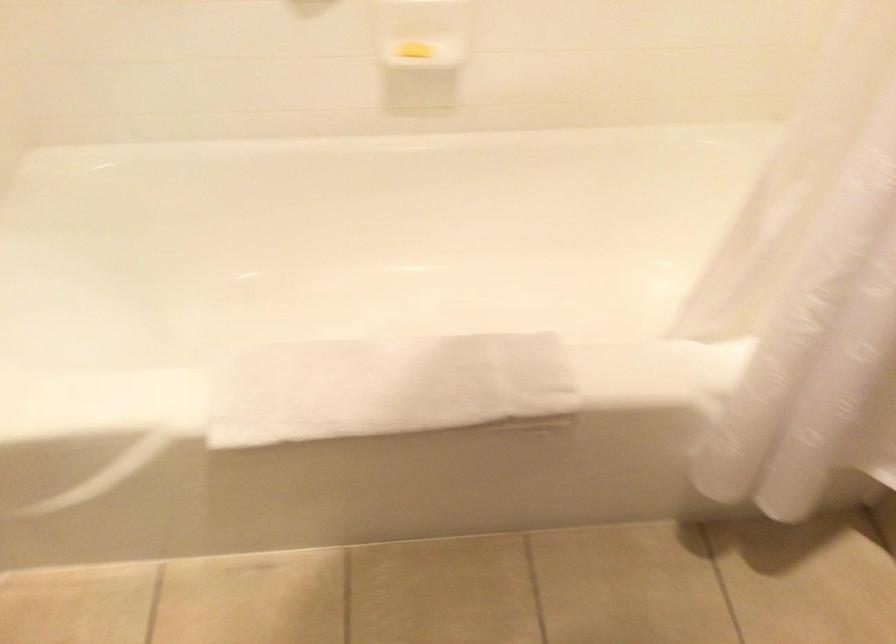
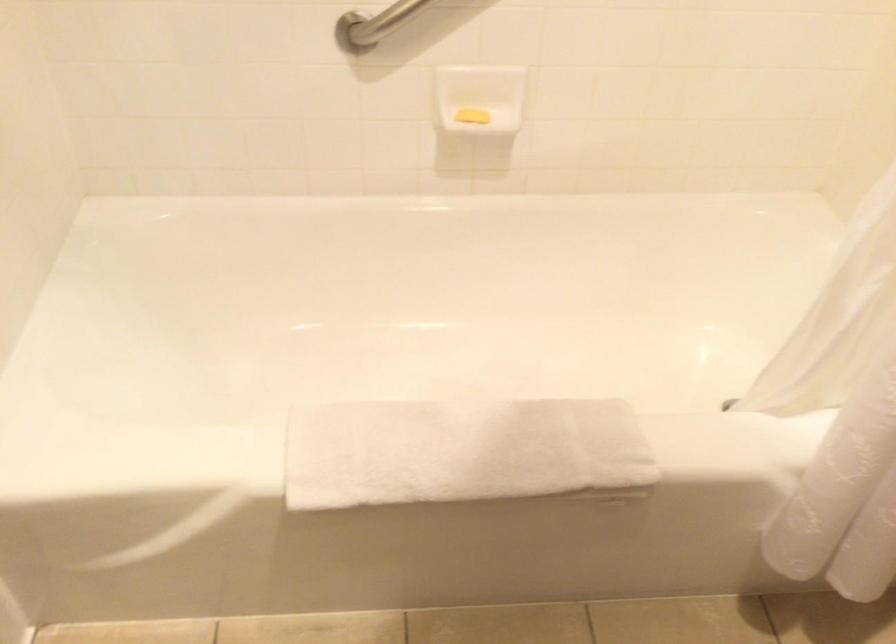
Find the pixel in the second image that matches point (382, 386) in the first image.

(460, 451)